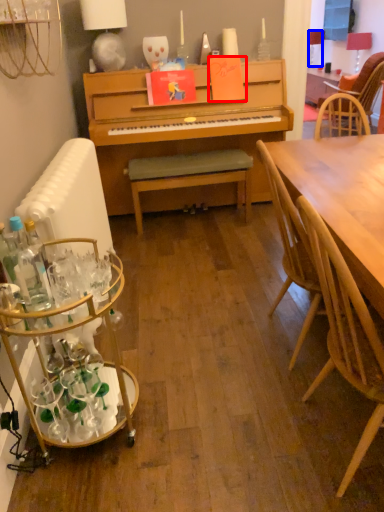
Question: Among these objects, which one is farthest to the camera, book (highlighted by a red box) or lamp (highlighted by a blue box)?

Choices:
 (A) book
 (B) lamp

Answer: (B)